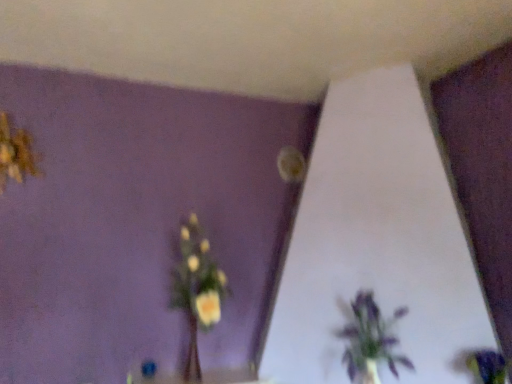
Question: From the image's perspective, does purple matte flower at lower right, arranged as the 1th flower when ordered from the bottom, appear lower than matte yellow flower at upper center, the second flower positioned from the left?

Choices:
 (A) no
 (B) yes

Answer: (B)

Question: From the image's perspective, is purple matte flower at lower right, the 3th flower viewed from the back, located above matte yellow flower at upper center, the second flower viewed from the right?

Choices:
 (A) no
 (B) yes

Answer: (A)

Question: Is matte yellow flower at upper center, the third flower from the front, surrounded by purple matte flower at lower right, the 1th flower viewed from the right?

Choices:
 (A) yes
 (B) no

Answer: (B)

Question: Can you confirm if purple matte flower at lower right, placed as the 3th flower when sorted from top to bottom, is taller than matte yellow flower at upper center, which appears as the second flower when viewed from the top?

Choices:
 (A) yes
 (B) no

Answer: (B)

Question: Can you confirm if purple matte flower at lower right, the 1th flower viewed from the right, is positioned to the right of matte yellow flower at upper center, the second flower positioned from the left?

Choices:
 (A) yes
 (B) no

Answer: (A)

Question: Can you confirm if purple matte flower at lower right, the first flower in the front-to-back sequence, is shorter than matte yellow flower at upper center, the second flower in the bottom-to-top sequence?

Choices:
 (A) yes
 (B) no

Answer: (A)

Question: Is purple matte plant at lower right not inside purple matte flower at lower right, arranged as the 1th flower when ordered from the bottom?

Choices:
 (A) no
 (B) yes

Answer: (B)

Question: Is purple matte plant at lower right wider than purple matte flower at lower right, the 1th flower viewed from the right?

Choices:
 (A) no
 (B) yes

Answer: (B)

Question: Is purple matte plant at lower right positioned with its back to purple matte flower at lower right, arranged as the 1th flower when ordered from the bottom?

Choices:
 (A) yes
 (B) no

Answer: (B)

Question: Is purple matte plant at lower right in contact with purple matte flower at lower right, the 1th flower viewed from the right?

Choices:
 (A) yes
 (B) no

Answer: (B)

Question: Does purple matte plant at lower right have a lesser width compared to purple matte flower at lower right, the 3th flower viewed from the back?

Choices:
 (A) yes
 (B) no

Answer: (B)

Question: Can you confirm if purple matte plant at lower right is bigger than purple matte flower at lower right, the first flower in the front-to-back sequence?

Choices:
 (A) yes
 (B) no

Answer: (A)

Question: From a real-world perspective, is yellow fabric flower at upper left, which ranks as the 1th flower in top-to-bottom order, on top of purple matte flower at lower right, arranged as the 1th flower when ordered from the bottom?

Choices:
 (A) yes
 (B) no

Answer: (A)